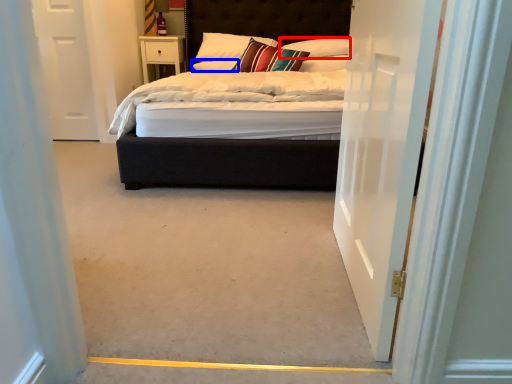
Question: Among these objects, which one is farthest to the camera, pillow (highlighted by a red box) or pillow (highlighted by a blue box)?

Choices:
 (A) pillow
 (B) pillow

Answer: (B)